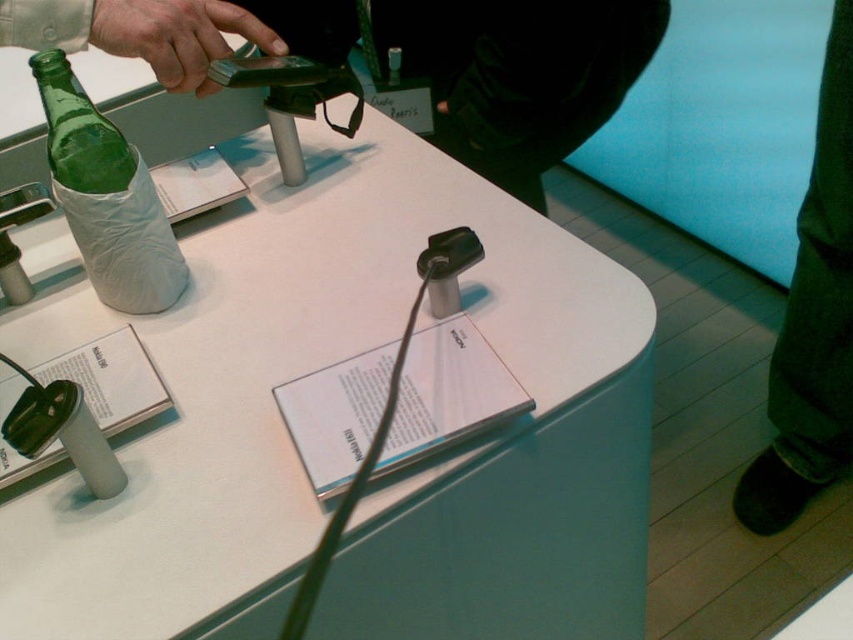
You are organizing items on a table and need to place a new item between the dark green pants at lower right and the green glass bottle at left. Which side should you place the new item closer to if it needs to be near the wider object?

The dark green pants at lower right are wider than the green glass bottle at left, so you should place the new item closer to the dark green pants at lower right.

Looking at the items on the table, which one is wider between the white paper at center and the green matte phone at upper left?

The white paper at center is wider than the green matte phone at upper left.